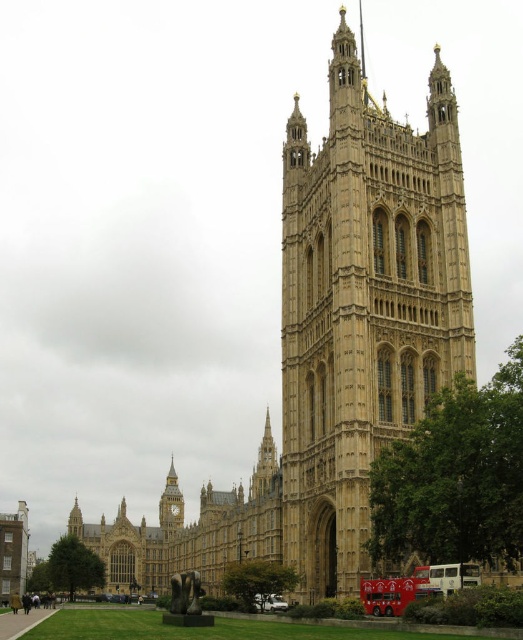
Between red painted bus at lower center and white metallic bus at lower center, which one appears on the left side from the viewer's perspective?

Positioned to the left is red painted bus at lower center.

Is point (425, 595) closer to camera compared to point (458, 570)?

No, it is not.

You are a GUI agent. You are given a task and a screenshot of the screen. Output one action in this format:
    pyautogui.click(x=<x>, y=<y>)
    Task: Click on the red painted bus at lower center
    Image resolution: width=523 pixels, height=640 pixels.
    Given the screenshot: What is the action you would take?
    pyautogui.click(x=393, y=593)

How distant is red painted bus at lower center from golden stone clock tower at center?

126.02 meters

Which is behind, point (402, 588) or point (169, 525)?

The point (169, 525) is behind.

Who is more forward, (415, 596) or (168, 502)?

Point (415, 596)

You are a GUI agent. You are given a task and a screenshot of the screen. Output one action in this format:
    pyautogui.click(x=<x>, y=<y>)
    Task: Click on the red painted bus at lower center
    The width and height of the screenshot is (523, 640).
    Given the screenshot: What is the action you would take?
    (393, 593)

Does golden stone tower at center appear over white metallic bus at lower center?

Yes.

Is golden stone tower at center taller than white metallic bus at lower center?

Yes.

This screenshot has width=523, height=640. Describe the element at coordinates (363, 305) in the screenshot. I see `golden stone tower at center` at that location.

The image size is (523, 640). I want to click on golden stone tower at center, so click(x=363, y=305).